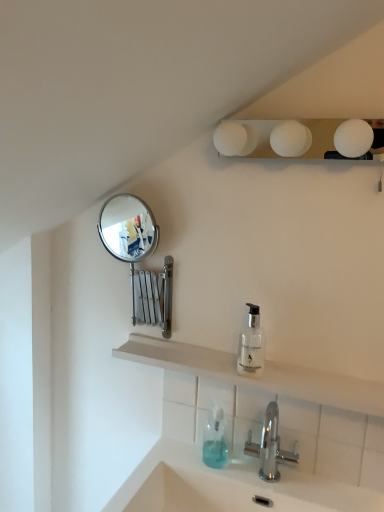
Locate an element on the screen. This screenshot has height=512, width=384. vacant space that is to the left of chrome metallic faucet at lower center is located at coordinates (198, 462).